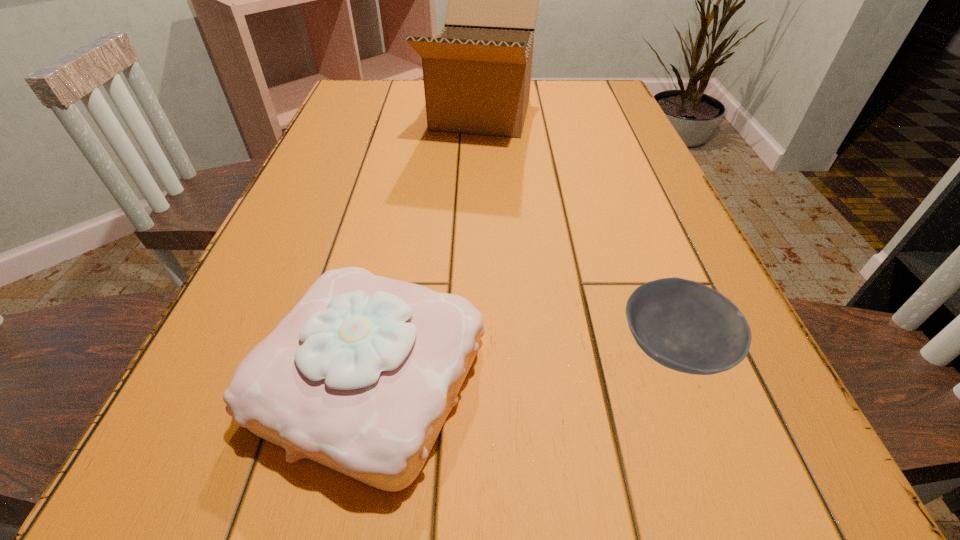
I want to click on vacant space that satisfies the following two spatial constraints: 1. on the front side of the box; 2. on the left side of the rightmost object, so click(x=483, y=349).

The image size is (960, 540). I want to click on free point that satisfies the following two spatial constraints: 1. on the back side of the farthest object; 2. on the right side of the second shortest object, so click(x=424, y=114).